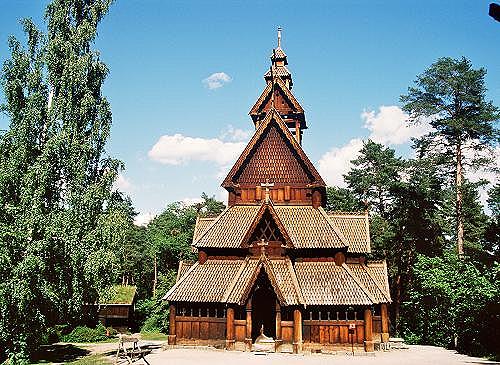
This screenshot has height=365, width=500. I want to click on windows, so click(181, 304), click(311, 316), click(329, 320), click(349, 319), click(362, 315), click(190, 303), click(202, 310), click(209, 313).